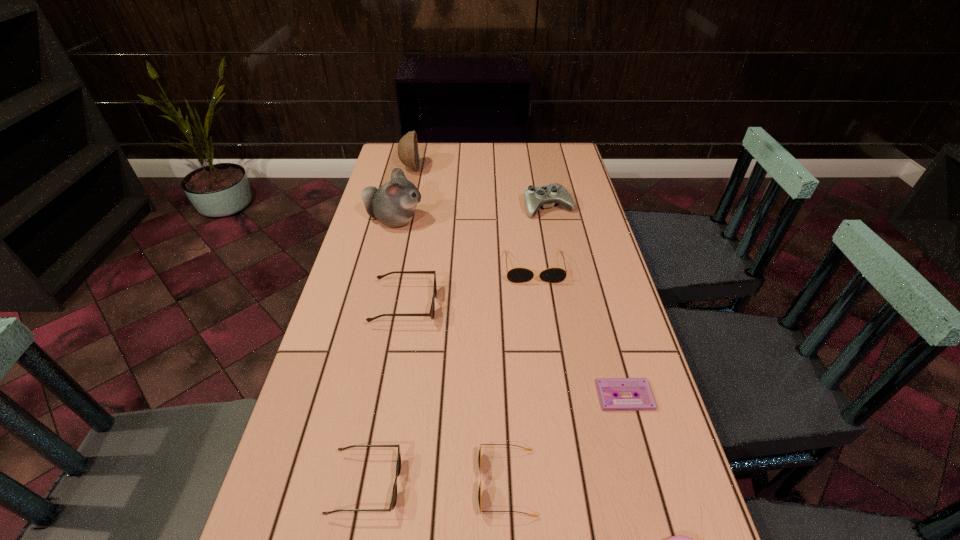
Where is `vacant space located 0.110m on the face of the hamster`? Image resolution: width=960 pixels, height=540 pixels. vacant space located 0.110m on the face of the hamster is located at coordinates (457, 220).

This screenshot has height=540, width=960. Find the location of `free space located on the front of the bowl`. free space located on the front of the bowl is located at coordinates (406, 187).

You are a GUI agent. You are given a task and a screenshot of the screen. Output one action in this format:
    pyautogui.click(x=<x>, y=<y>)
    Task: Click on the vacant region located on the front of the control
    
    Given the screenshot: What is the action you would take?
    pyautogui.click(x=552, y=229)

In order to click on free space located 0.150m on the front-facing side of the bigger black sunglasses in this screenshot , I will do `click(541, 325)`.

Where is `free space located 0.090m on the front lenses of the farther brown sunglasses`? The width and height of the screenshot is (960, 540). free space located 0.090m on the front lenses of the farther brown sunglasses is located at coordinates (469, 305).

Locate an element on the screen. Image resolution: width=960 pixels, height=540 pixels. free point located 0.090m on the front-facing side of the smaller black sunglasses is located at coordinates (431, 483).

You are a GUI agent. You are given a task and a screenshot of the screen. Output one action in this format:
    pyautogui.click(x=<x>, y=<y>)
    Task: Click on the vacant space situated 0.220m on the front-facing side of the smaller black sunglasses
    
    Given the screenshot: What is the action you would take?
    pyautogui.click(x=364, y=483)

Find the location of a particular element. This screenshot has width=960, height=540. vacant space located on the front-facing side of the smaller black sunglasses is located at coordinates (275, 483).

Locate an element on the screen. Image resolution: width=960 pixels, height=540 pixels. free space located 0.380m on the front lenses of the nearer brown sunglasses is located at coordinates (598, 484).

At what (x,y) coordinates should I click in order to perform the action: click on free space located 0.360m on the back of the fourth nearest object. Please return your answer as a coordinate pair (x, y). Looking at the image, I should click on (591, 275).